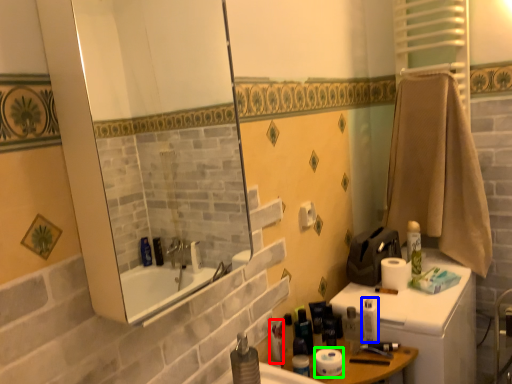
Question: Which is farther away from toiletry (highlighted by a red box)? toiletry (highlighted by a blue box) or toilet paper (highlighted by a green box)?

Choices:
 (A) toiletry
 (B) toilet paper

Answer: (A)